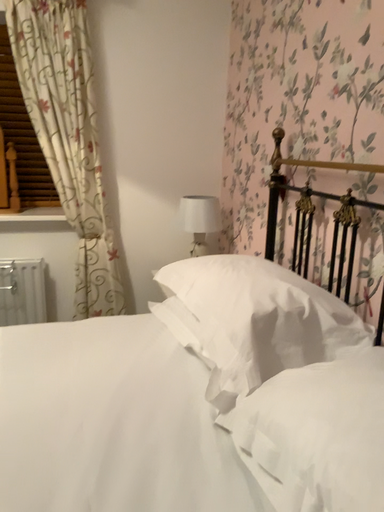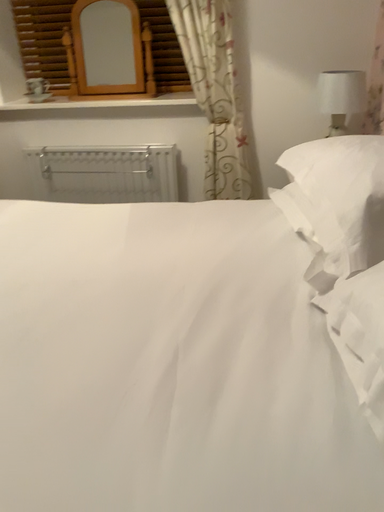
Question: How did the camera likely rotate when shooting the video?

Choices:
 (A) rotated upward
 (B) rotated downward

Answer: (B)